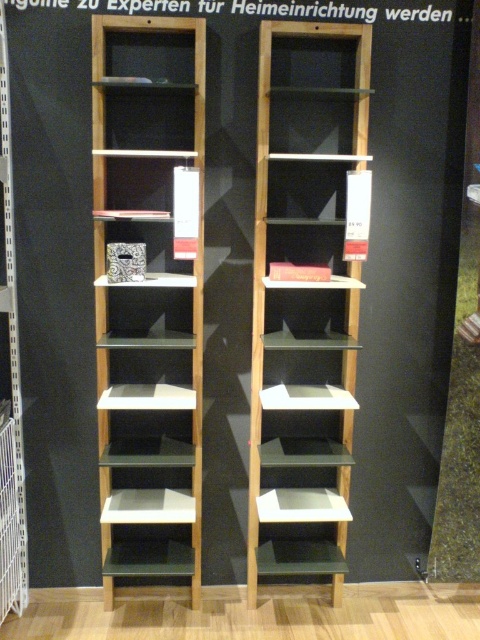
Based on the photo, is light brown wood bookshelf at center in front of light brown wood bookshelf at left?

Yes, it is.

Is point (348, 70) behind point (16, 392)?

No, (348, 70) is in front of (16, 392).

The height and width of the screenshot is (640, 480). What do you see at coordinates (307, 296) in the screenshot?
I see `light brown wood bookshelf at center` at bounding box center [307, 296].

Find the location of a particular element. The image size is (480, 640). light brown wood bookshelf at center is located at coordinates (307, 296).

Can you confirm if matte oak bookshelf at center is smaller than light brown wood bookshelf at left?

Actually, matte oak bookshelf at center might be larger than light brown wood bookshelf at left.

Does matte oak bookshelf at center appear under light brown wood bookshelf at left?

Correct, matte oak bookshelf at center is located below light brown wood bookshelf at left.

Where is `matte oak bookshelf at center`? matte oak bookshelf at center is located at coordinates (x=148, y=292).

In the scene shown: Is matte oak bookshelf at center further to the viewer compared to light brown wood bookshelf at center?

No, it is in front of light brown wood bookshelf at center.

Does matte oak bookshelf at center appear over light brown wood bookshelf at center?

Yes.

Does point (180, 157) come in front of point (265, 323)?

Yes.

Where is `matte oak bookshelf at center`? The image size is (480, 640). matte oak bookshelf at center is located at coordinates (148, 292).